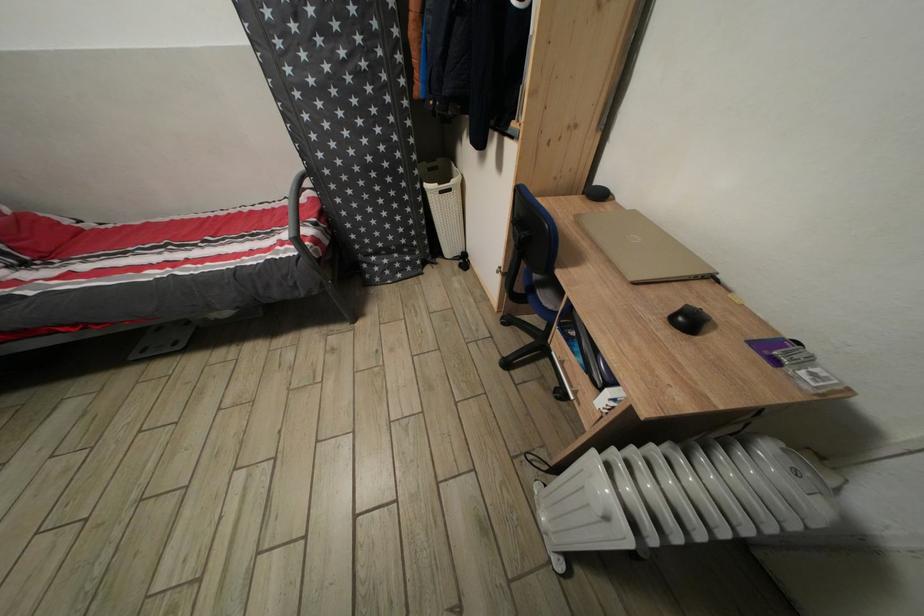
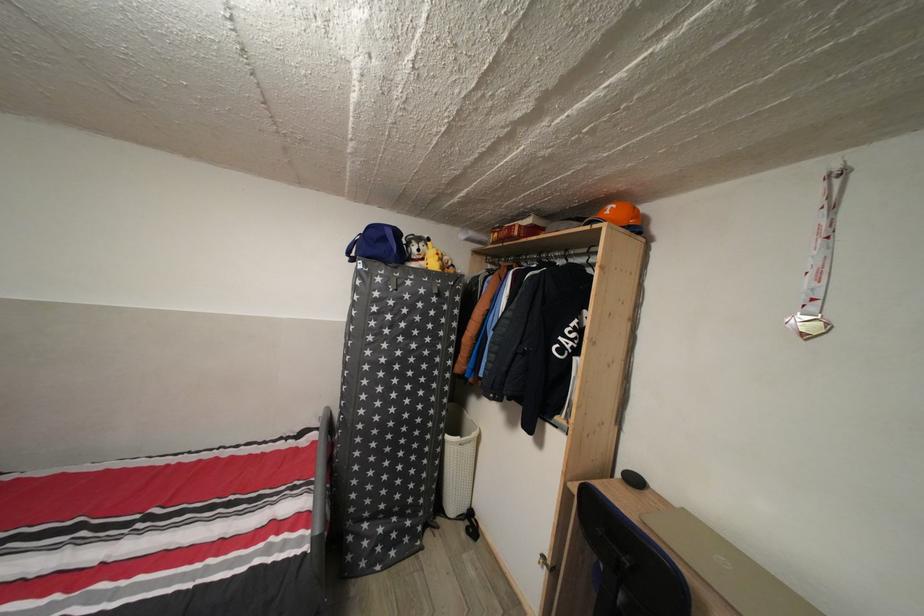
Question: The images are taken continuously from a first-person perspective. In which direction is your viewpoint rotating?

Choices:
 (A) Left
 (B) Right
 (C) Up
 (D) Down

Answer: (C)